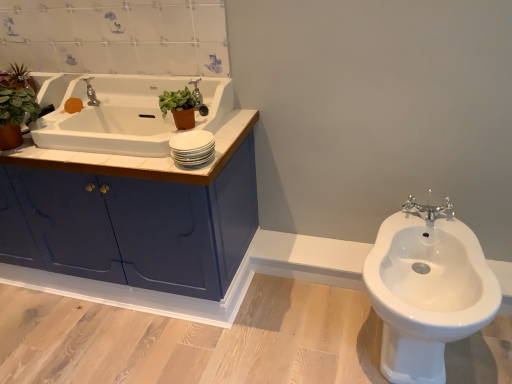
Where is `free location to the right of orange matte soap at upper left`? The width and height of the screenshot is (512, 384). free location to the right of orange matte soap at upper left is located at coordinates (108, 111).